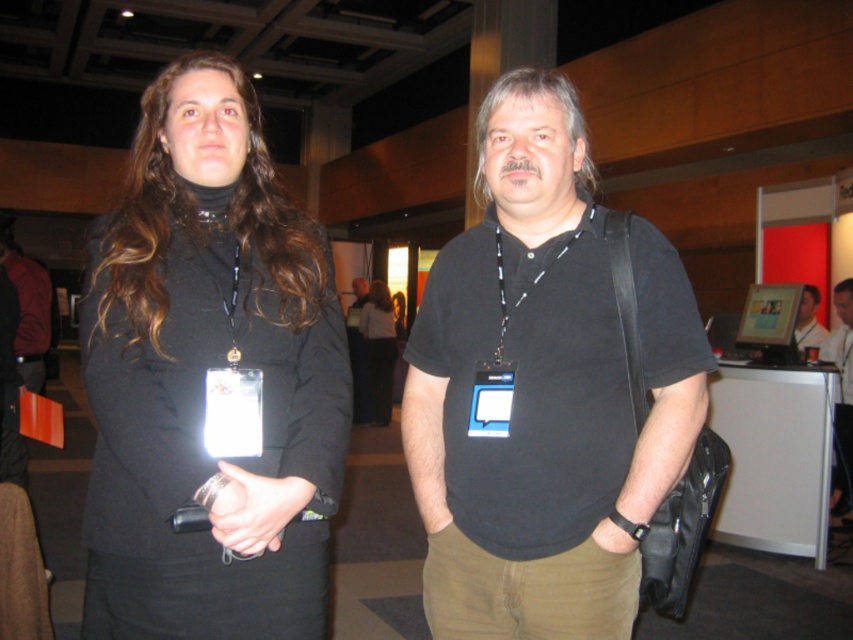
Question: Which of the following is the closest to the observer?

Choices:
 (A) black matte jacket at left
 (B) black matte shirt at center

Answer: (A)

Question: Which object appears closest to the camera in this image?

Choices:
 (A) black matte jacket at left
 (B) black cotton shirt at center
 (C) black fabric jacket at center

Answer: (B)

Question: Is the position of matte black jacket at left more distant than that of black matte shirt at center?

Choices:
 (A) yes
 (B) no

Answer: (B)

Question: Does black cotton shirt at center appear under matte black shirt at center?

Choices:
 (A) no
 (B) yes

Answer: (B)

Question: Can you confirm if black matte jacket at left is positioned to the right of black cotton shirt at center?

Choices:
 (A) no
 (B) yes

Answer: (B)

Question: Estimate the real-world distances between objects in this image. Which object is farther from the matte black shirt at center?

Choices:
 (A) black cotton shirt at center
 (B) black fabric jacket at center
 (C) matte black jacket at left

Answer: (B)